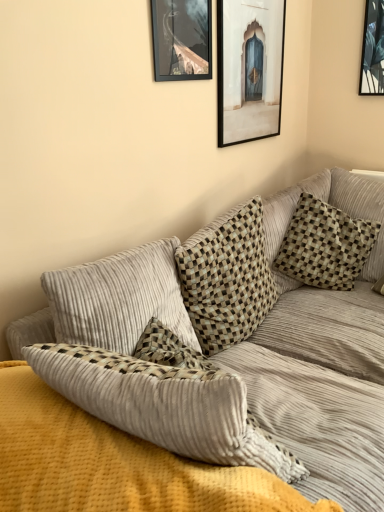
Question: Which direction should I rotate to look at checkered fabric pillow at center, which is the 2th pillow from right to left, — up or down?

Choices:
 (A) down
 (B) up

Answer: (A)

Question: From the image's perspective, is checkered fabric pillow at upper right, the 2th pillow positioned from the left, below corduroy couch at center?

Choices:
 (A) no
 (B) yes

Answer: (A)

Question: Is checkered fabric pillow at upper right, the 2th pillow positioned from the left, directly adjacent to corduroy couch at center?

Choices:
 (A) yes
 (B) no

Answer: (B)

Question: Is checkered fabric pillow at upper right, the 1th pillow in the right-to-left sequence, wider than corduroy couch at center?

Choices:
 (A) yes
 (B) no

Answer: (B)

Question: Is checkered fabric pillow at upper right, the 2th pillow positioned from the left, far away from corduroy couch at center?

Choices:
 (A) yes
 (B) no

Answer: (B)

Question: Is checkered fabric pillow at upper right, the 2th pillow positioned from the left, positioned with its back to corduroy couch at center?

Choices:
 (A) yes
 (B) no

Answer: (B)

Question: Is checkered fabric pillow at upper right, the 2th pillow positioned from the left, shorter than corduroy couch at center?

Choices:
 (A) yes
 (B) no

Answer: (A)

Question: Is matte black picture frame at upper center, which is the second picture frame in right-to-left order, to the right of matte wooden picture frame at upper center, which is counted as the 1th picture frame, starting from the back, from the viewer's perspective?

Choices:
 (A) yes
 (B) no

Answer: (B)

Question: Can you confirm if matte black picture frame at upper center, which is the second picture frame in right-to-left order, is wider than matte wooden picture frame at upper center, placed as the second picture frame when sorted from front to back?

Choices:
 (A) no
 (B) yes

Answer: (A)

Question: Is matte black picture frame at upper center, which is the second picture frame in right-to-left order, positioned with its back to matte wooden picture frame at upper center, which is counted as the 1th picture frame, starting from the back?

Choices:
 (A) yes
 (B) no

Answer: (B)

Question: From a real-world perspective, is matte black picture frame at upper center, positioned as the first picture frame in left-to-right order, positioned over matte wooden picture frame at upper center, marked as the 1th picture frame in a right-to-left arrangement, based on gravity?

Choices:
 (A) no
 (B) yes

Answer: (B)

Question: Is matte black picture frame at upper center, positioned as the first picture frame in left-to-right order, taller than matte wooden picture frame at upper center, marked as the 1th picture frame in a right-to-left arrangement?

Choices:
 (A) yes
 (B) no

Answer: (B)

Question: Is matte black picture frame at upper center, which is counted as the 1th picture frame, starting from the front, behind matte wooden picture frame at upper center, which is counted as the 1th picture frame, starting from the back?

Choices:
 (A) no
 (B) yes

Answer: (A)

Question: From the image's perspective, is checkered fabric pillow at center, the first pillow viewed from the left, over checkered fabric pillow at upper right, the 2th pillow positioned from the left?

Choices:
 (A) no
 (B) yes

Answer: (A)